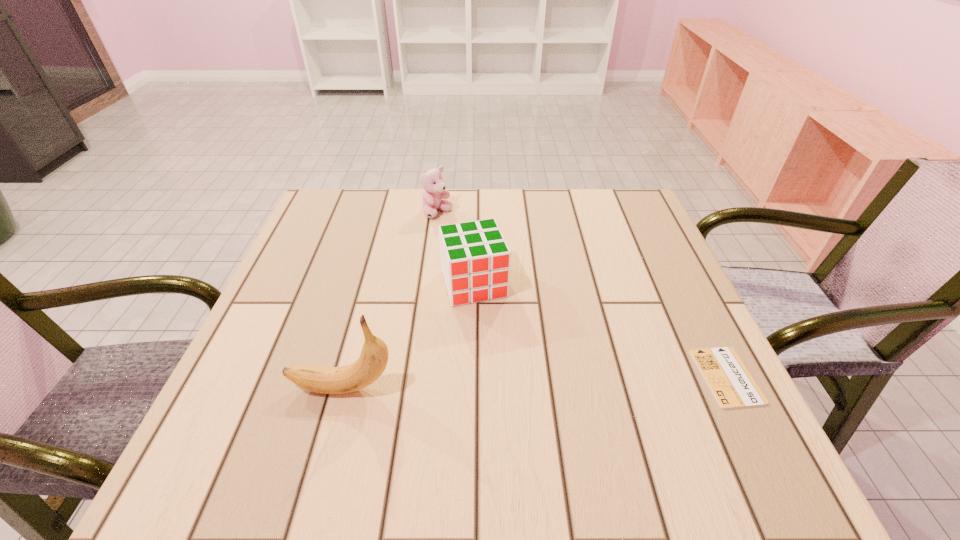
At what (x,y) coordinates should I click in order to perform the action: click on vacant space located 0.310m at the face of the farthest object. Please return your answer as a coordinate pair (x, y). The image size is (960, 540). Looking at the image, I should click on (491, 296).

The width and height of the screenshot is (960, 540). In order to click on free point located at the face of the farthest object in this screenshot , I will do `click(487, 291)`.

Where is `free space located on the red face of the second farthest object`? This screenshot has width=960, height=540. free space located on the red face of the second farthest object is located at coordinates (516, 409).

Where is `free location located on the red face of the second farthest object`? This screenshot has width=960, height=540. free location located on the red face of the second farthest object is located at coordinates (520, 419).

Where is `blank space located on the red face of the second farthest object`? The height and width of the screenshot is (540, 960). blank space located on the red face of the second farthest object is located at coordinates (507, 380).

You are a GUI agent. You are given a task and a screenshot of the screen. Output one action in this format:
    pyautogui.click(x=<x>, y=<y>)
    Task: Click on the object that is positioned at the far edge
    This screenshot has width=960, height=540.
    Given the screenshot: What is the action you would take?
    pyautogui.click(x=434, y=191)

At what (x,y) coordinates should I click in order to perform the action: click on banana at the near edge. Please return your answer as a coordinate pair (x, y). Looking at the image, I should click on (373, 359).

You are a GUI agent. You are given a task and a screenshot of the screen. Output one action in this format:
    pyautogui.click(x=<x>, y=<y>)
    Task: Click on the identity card situated at the near edge
    The width and height of the screenshot is (960, 540).
    Given the screenshot: What is the action you would take?
    pyautogui.click(x=732, y=385)

Where is `object present at the left edge`? Image resolution: width=960 pixels, height=540 pixels. object present at the left edge is located at coordinates (373, 359).

Where is `object present at the right edge`? object present at the right edge is located at coordinates (732, 385).